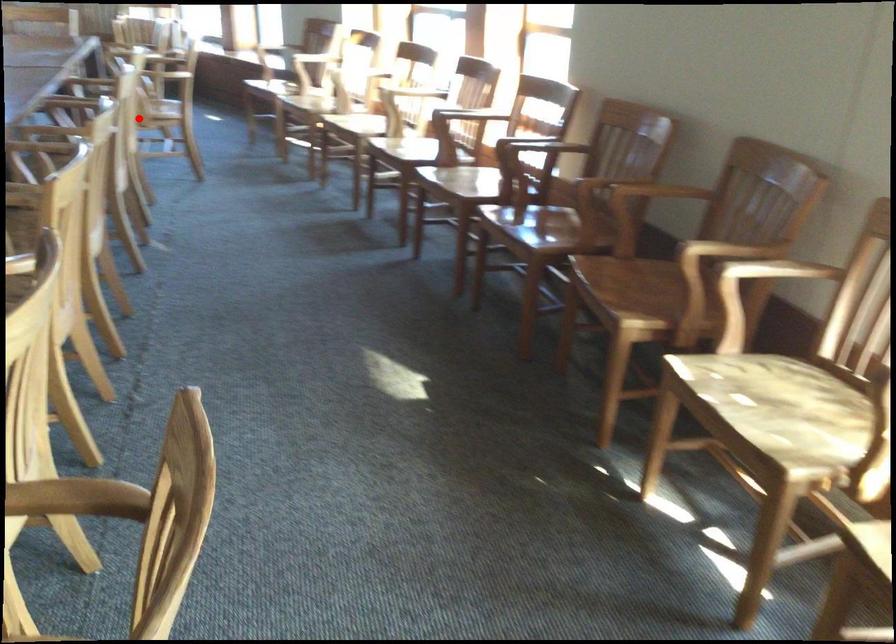
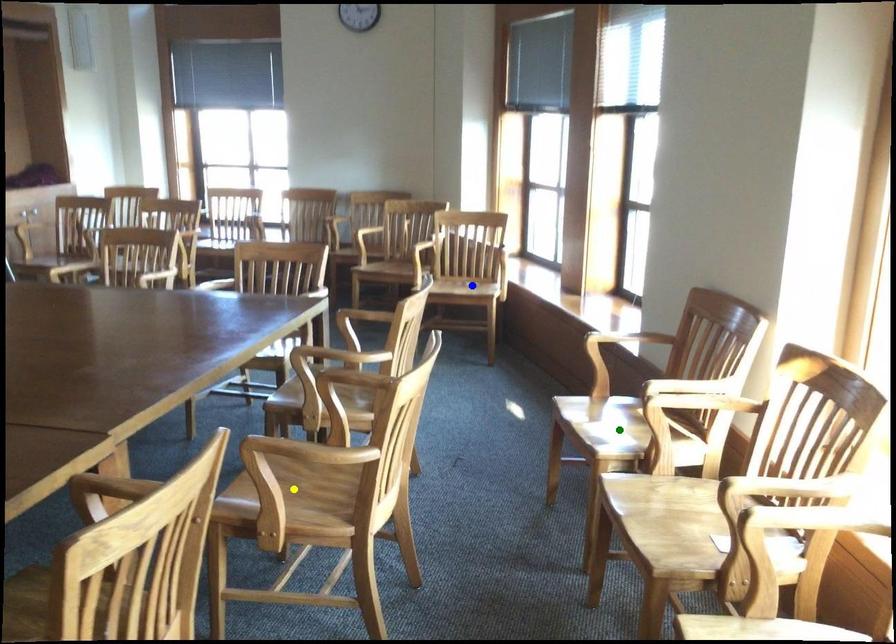
Question: I am providing you with two images of the same scene from different viewpoints. A red point is marked on the first image. You are given multiple points on the second image. In image 2, which mark is for the same physical point as the one in image 1?

Choices:
 (A) yellow point
 (B) blue point
 (C) green point

Answer: (A)